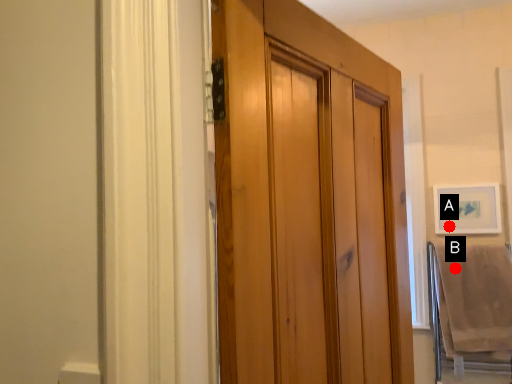
Question: Two points are circled on the image, labeled by A and B beside each circle. Which point appears farthest from the camera in this image?

Choices:
 (A) A is further
 (B) B is further

Answer: (A)